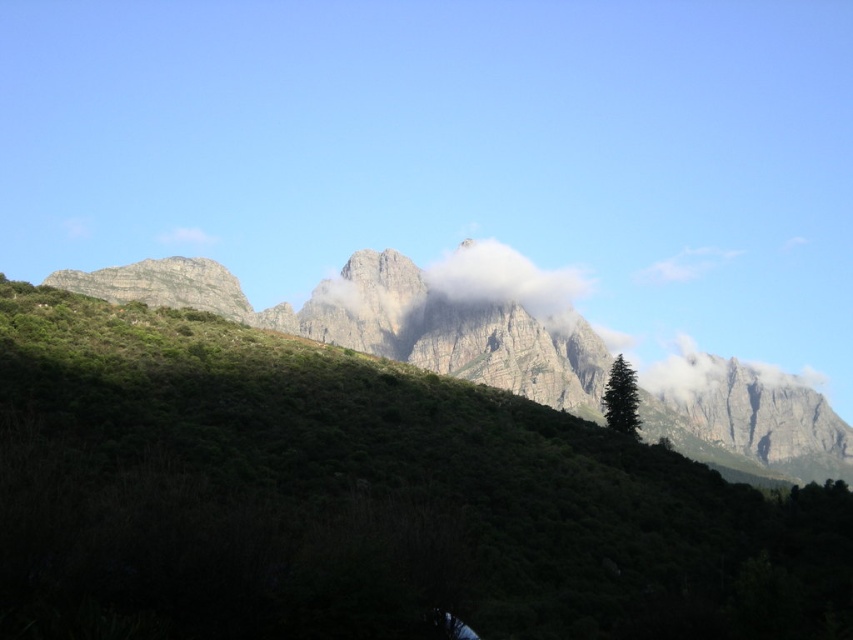
Is green textured hillside at center positioned in front of white fluffy cloud at center?

Yes, it is.

Which is behind, point (321, 627) or point (469, 240)?

Point (469, 240)

Image resolution: width=853 pixels, height=640 pixels. I want to click on green textured hillside at center, so (360, 499).